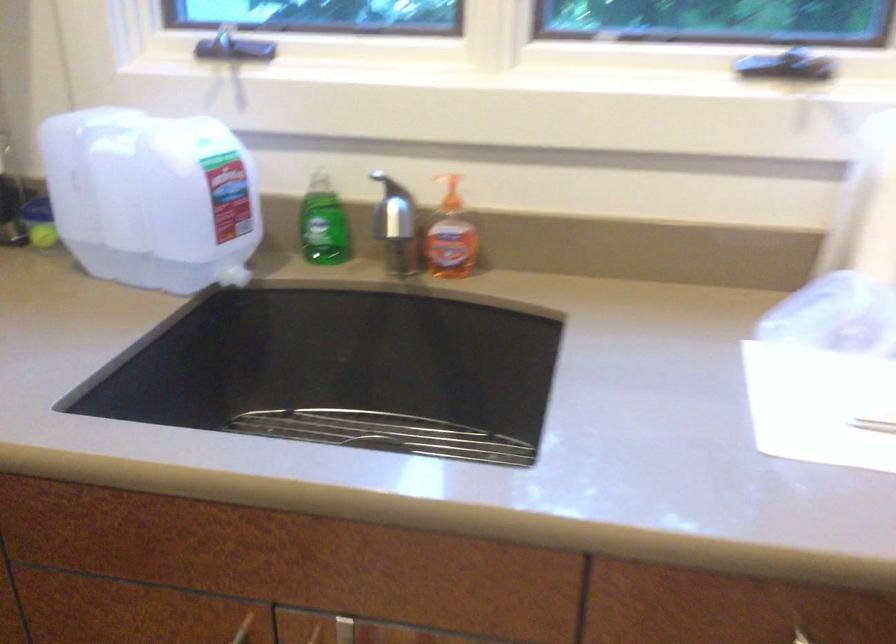
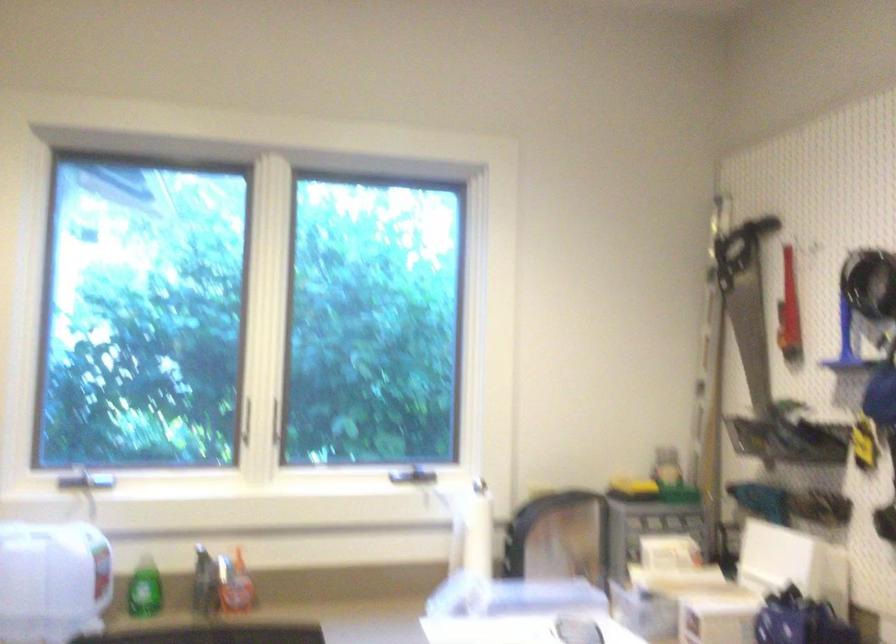
Locate, in the second image, the point that corresponds to (x=398, y=229) in the first image.

(204, 583)